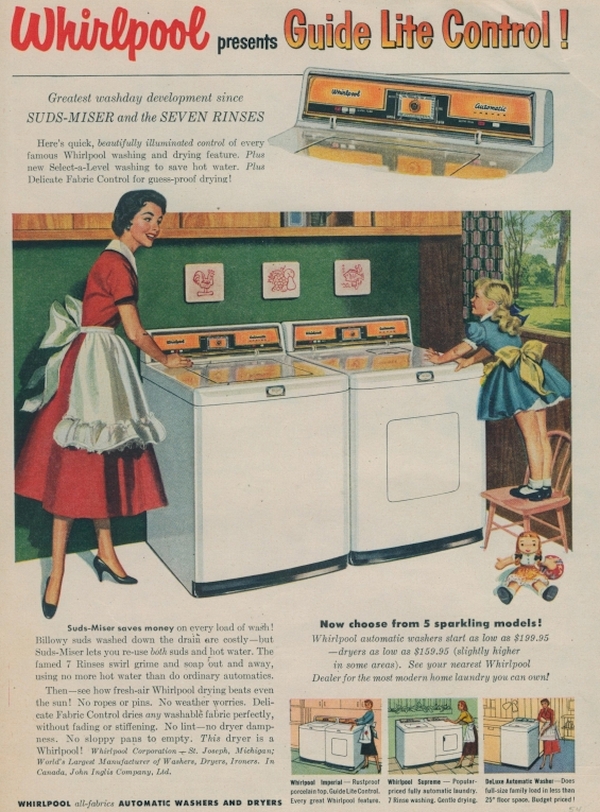
The image size is (600, 812). I want to click on floor, so click(x=376, y=589).